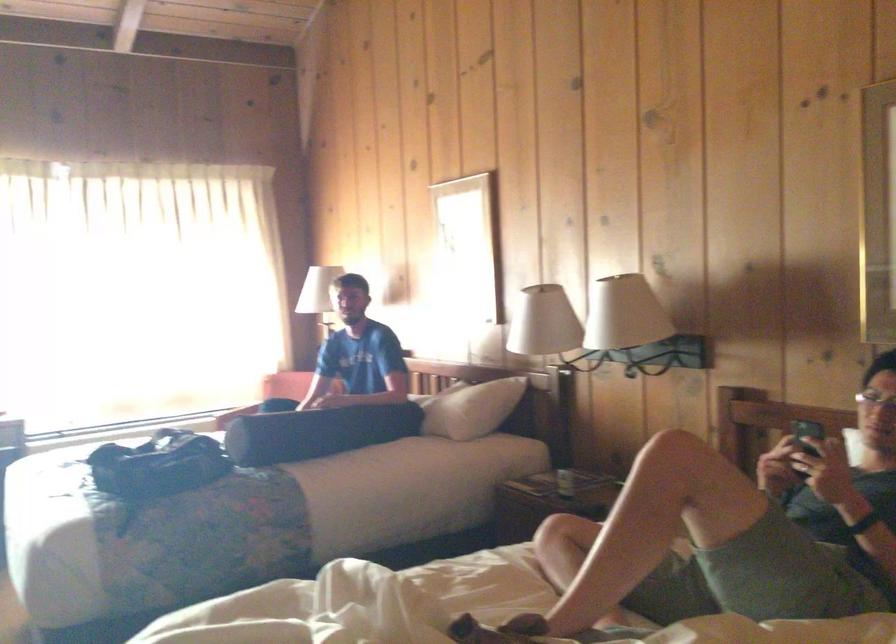
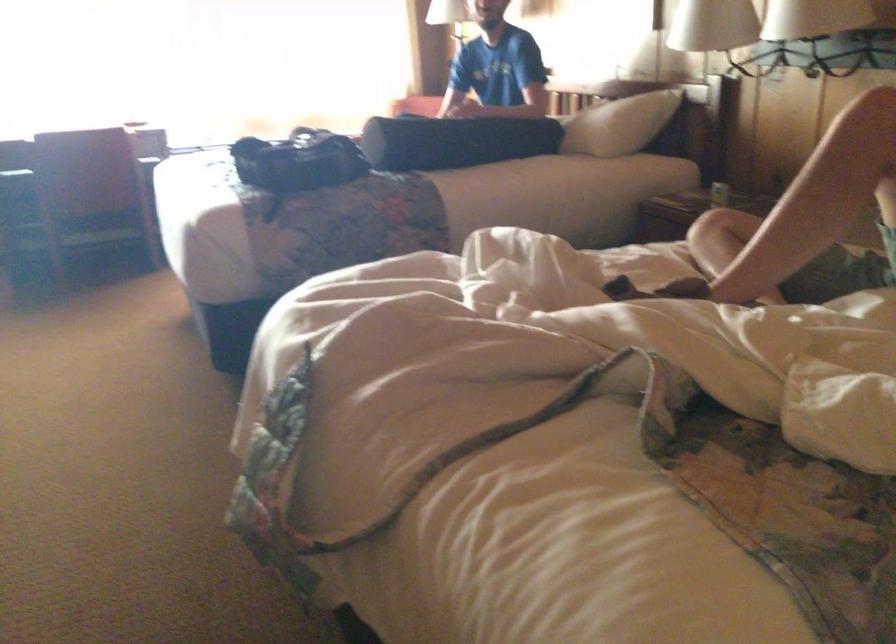
Find the pixel in the second image that matches point 159,468 in the first image.

(297, 161)